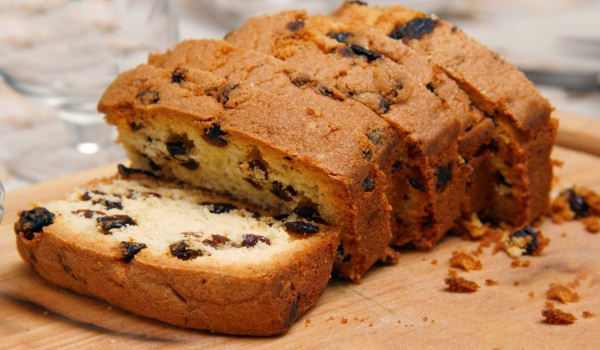
What are the coordinates of `read edge of cutting board right center` in the screenshot? It's located at (590, 126), (568, 118).